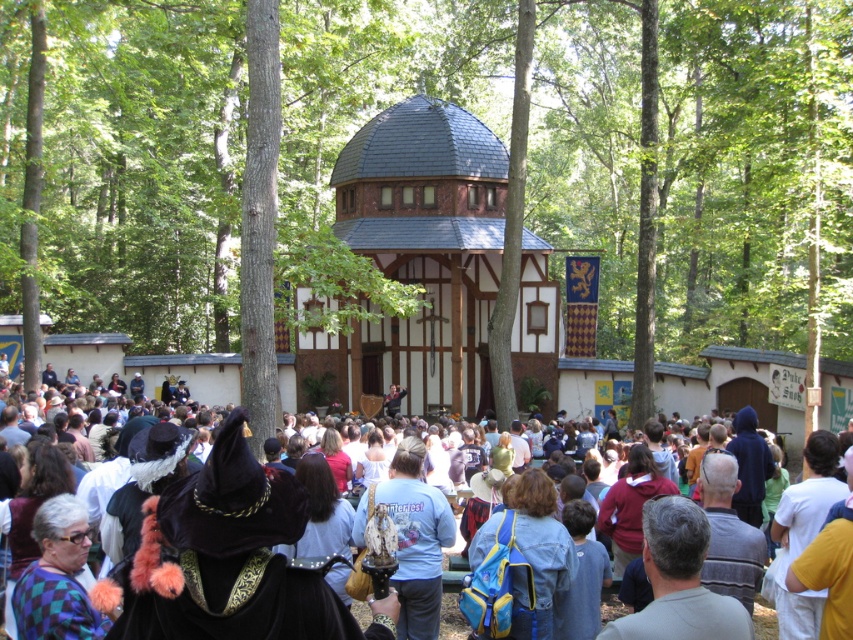
You are a knight standing in the middle of the wooden pavilion. You notice a brown wood tree at center and a velvet hat at center. Which object is taller?

The brown wood tree at center is taller than the velvet hat at center.